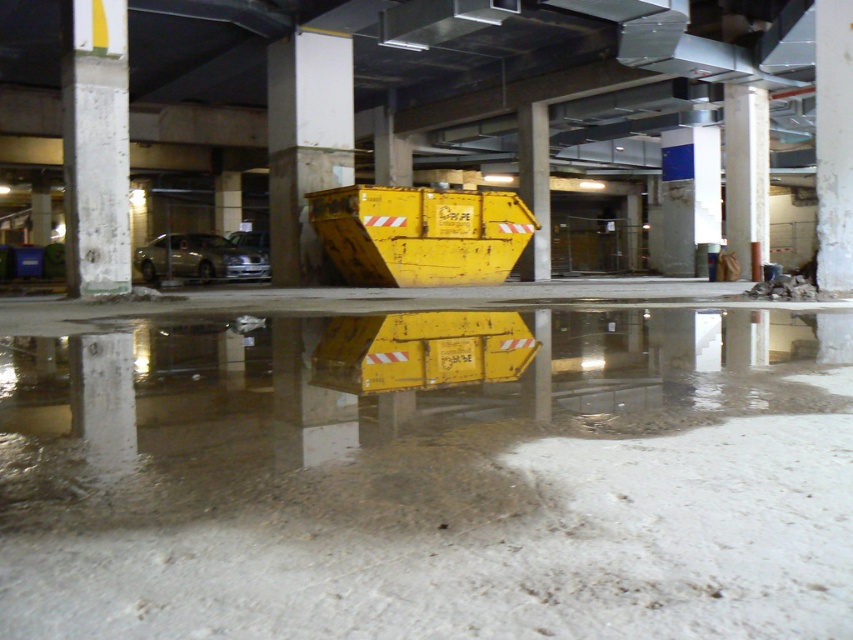
Can you confirm if yellow metallic dumpster at center is positioned below white concrete pillar at center?

Yes, yellow metallic dumpster at center is below white concrete pillar at center.

Can you confirm if yellow metallic dumpster at center is positioned above white concrete pillar at center?

No, yellow metallic dumpster at center is not above white concrete pillar at center.

Between point (364, 397) and point (277, 67), which one is positioned in front?

Positioned in front is point (364, 397).

This screenshot has width=853, height=640. I want to click on yellow metallic dumpster at center, so click(x=431, y=484).

Locate an element on the screen. Image resolution: width=853 pixels, height=640 pixels. white concrete pillar at center is located at coordinates (305, 145).

Which of these two, white concrete pillar at center or concrete at center, stands shorter?

With less height is white concrete pillar at center.

Is point (274, 228) behind point (747, 211)?

Yes, it is.

The width and height of the screenshot is (853, 640). I want to click on white concrete pillar at center, so click(305, 145).

Is white concrete pillar at left above concrete at center?

No.

How far apart are white concrete pillar at left and concrete at center?

white concrete pillar at left is 11.83 meters from concrete at center.

Describe the element at coordinates (96, 148) in the screenshot. I see `white concrete pillar at left` at that location.

Image resolution: width=853 pixels, height=640 pixels. I want to click on white concrete pillar at left, so pos(96,148).